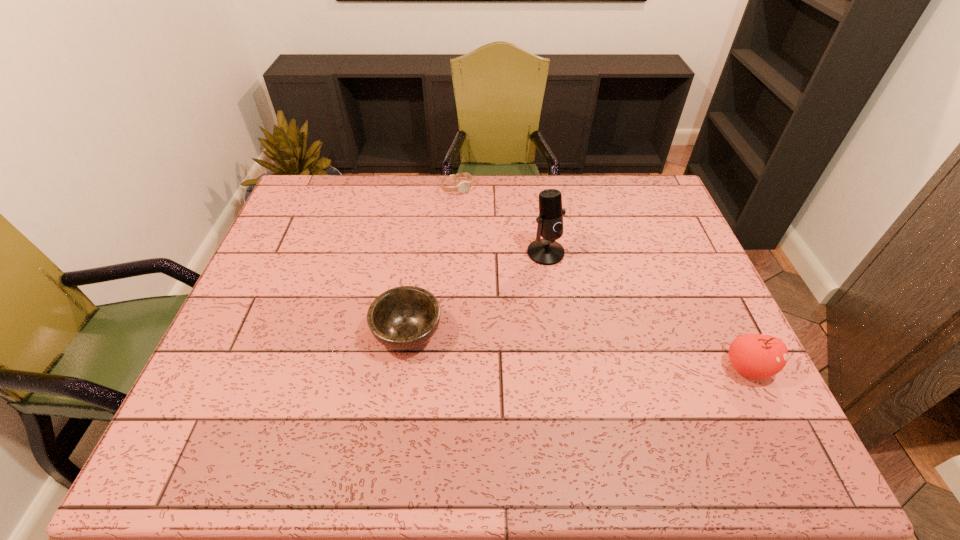
I want to click on free spot that satisfies the following two spatial constraints: 1. on the back side of the farthest object; 2. on the right side of the second shortest object, so click(428, 188).